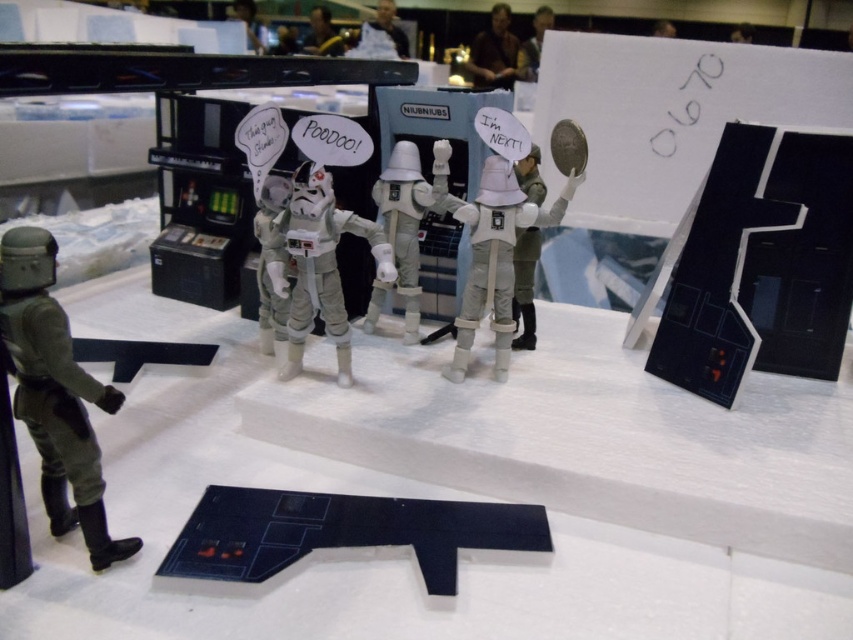
In the futuristic diorama scene, there is a white matte stormtrooper at center and a dark brown leather jacket at upper center. Which object is positioned to the right side?

The dark brown leather jacket at upper center is positioned to the right of the white matte stormtrooper at center.

You are a figure in the miniature diorama and need to move from the green armored figure facing away to the white matte stormtrooper at center. Based on their positions, which direction should you head towards?

The white matte stormtrooper at center is located at point (322, 264), so you should head towards the center of the image where the coordinates indicate the white matte stormtrooper at center is positioned.

You are designing a display case for the white matte stormtrooper at center and the white matte astronaut helmet at center. If the case has a width limit of 10 cm, which object might not fit if placed alone?

The white matte stormtrooper at center has a greater width than the white matte astronaut helmet at center, so the stormtrooper might not fit in the display case if placed alone.